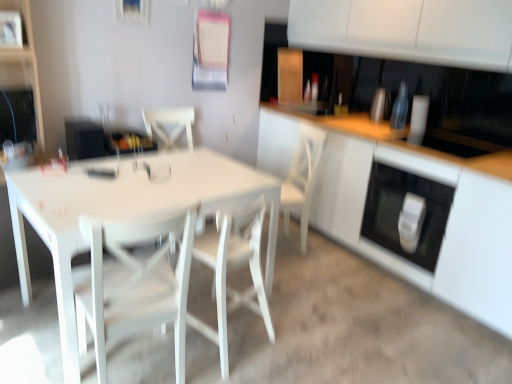
At what (x,y) coordinates should I click in order to perform the action: click on unoccupied area in front of white wood chair at center. Please return your answer as a coordinate pair (x, y). The height and width of the screenshot is (384, 512). Looking at the image, I should click on (302, 274).